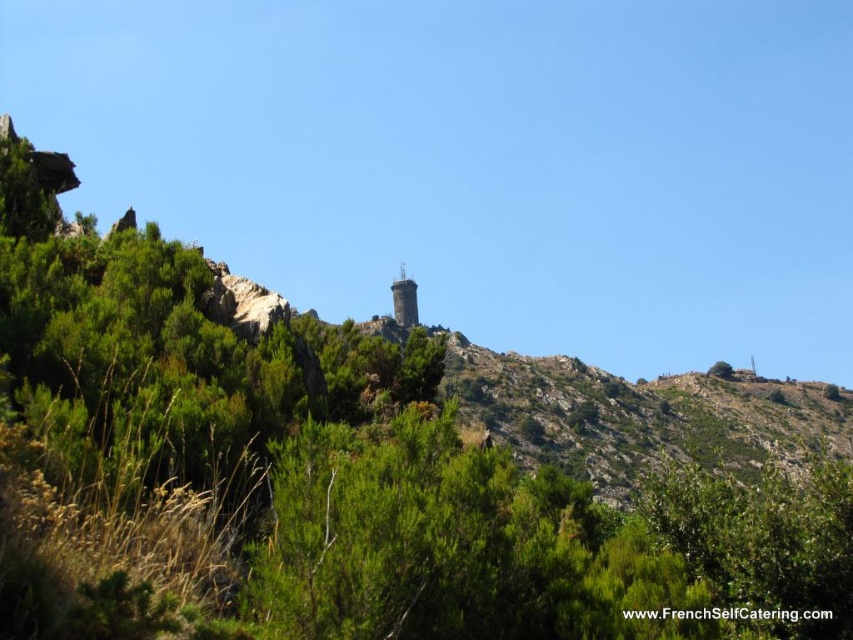
You are a hiker planning to walk from the brown stone tower at center to the green leafy tree at upper right. Given that your average walking speed is 3 km per hour, how many minutes will it take you to reach the tree?

The distance between the brown stone tower at center and the green leafy tree at upper right is 111.46 meters. Converting meters to kilometers, that is 0.11146 km. Dividing the distance by your walking speed of 3 km per hour gives approximately 0.037 hours. Multiplying by 60 minutes, this equals roughly 2.22 minutes. Therefore, it will take about 2 minutes to reach the tree.

You are a hiker who needs to determine the best path to reach the summit. You notice the brown stone tower at center and the green leafy tree at upper right in your line of sight. Which object would you use as a reference point if you want to choose a path that avoids narrow, rocky areas?

The brown stone tower at center is thinner than the green leafy tree at upper right. Since the tower is thinner, it suggests that the area around it might be more open and less obstructed by large rocks, making it a better reference point to avoid narrow, rocky paths.